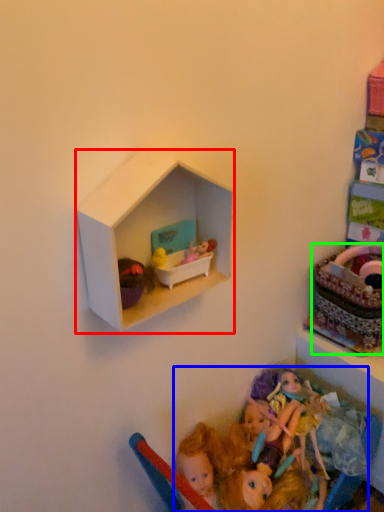
Question: Considering the real-world distances, which object is closest to shelf (highlighted by a red box)? doll (highlighted by a blue box) or basket (highlighted by a green box).

Choices:
 (A) doll
 (B) basket

Answer: (A)